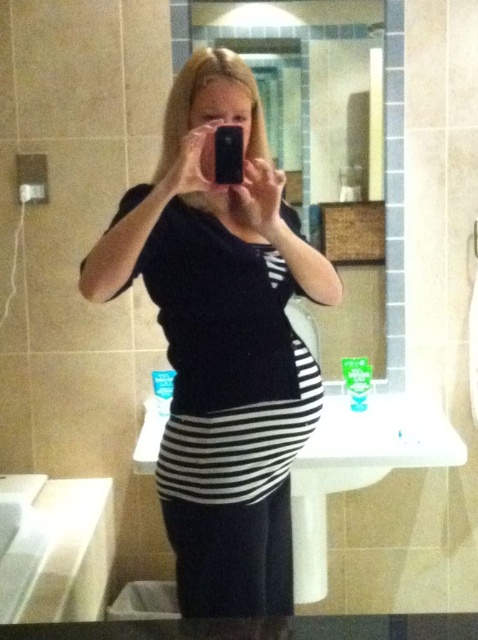
Question: Which point is closer to the camera?

Choices:
 (A) glossy plastic mirror at upper center
 (B) black striped shirt at center

Answer: (B)

Question: From the image, what is the correct spatial relationship of black striped shirt at center in relation to glossy plastic mirror at upper center?

Choices:
 (A) right
 (B) left

Answer: (B)

Question: Does black striped shirt at center lie in front of glossy plastic mirror at upper center?

Choices:
 (A) no
 (B) yes

Answer: (B)

Question: Which point is closer to the camera?

Choices:
 (A) (232, 28)
 (B) (265, 426)

Answer: (B)

Question: Which object is farther from the camera taking this photo?

Choices:
 (A) black striped shirt at center
 (B) glossy plastic mirror at upper center

Answer: (B)

Question: Is black striped shirt at center wider than glossy plastic mirror at upper center?

Choices:
 (A) no
 (B) yes

Answer: (A)